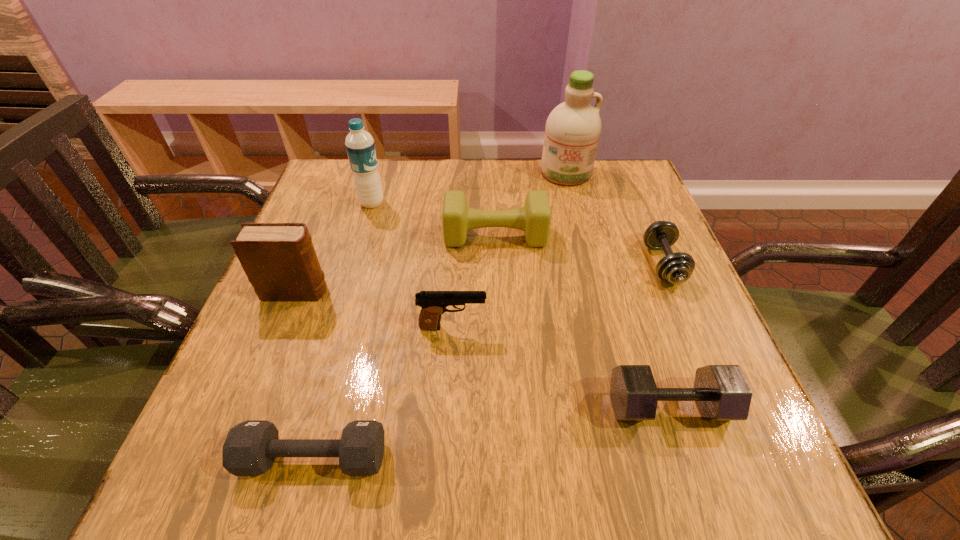
Where is `water bottle that is positioned at the left edge`? This screenshot has width=960, height=540. water bottle that is positioned at the left edge is located at coordinates (360, 146).

Locate an element on the screen. diary at the left edge is located at coordinates (279, 259).

Where is `dumbbell present at the left edge`? dumbbell present at the left edge is located at coordinates [250, 448].

The width and height of the screenshot is (960, 540). I want to click on cleansing agent that is positioned at the right edge, so click(x=573, y=128).

This screenshot has width=960, height=540. Find the location of `object at the far left corner`. object at the far left corner is located at coordinates (360, 146).

This screenshot has width=960, height=540. In order to click on object at the near left corner in this screenshot , I will do `click(250, 448)`.

Where is `object present at the far right corner`? object present at the far right corner is located at coordinates point(573,128).

Locate an element on the screen. The width and height of the screenshot is (960, 540). free space at the far edge is located at coordinates (461, 163).

Where is `free region at the near edge of the desktop`? free region at the near edge of the desktop is located at coordinates (485, 484).

In the image, there is a desktop. At what (x,y) coordinates should I click in order to perform the action: click on blank space at the left edge. Please return your answer as a coordinate pair (x, y). This screenshot has width=960, height=540. Looking at the image, I should click on (287, 307).